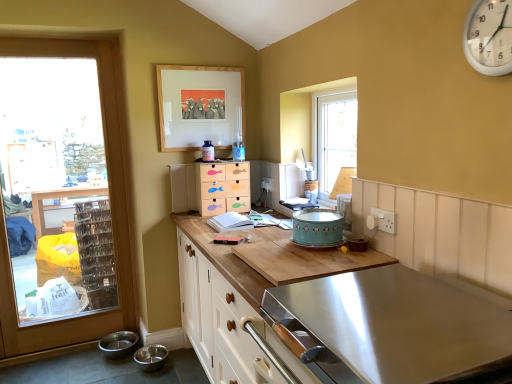
Question: From a real-world perspective, is white plastic clock at upper right located higher than wooden drawers at center, which ranks as the first appliance in back-to-front order?

Choices:
 (A) yes
 (B) no

Answer: (A)

Question: Is white plastic clock at upper right positioned with its back to wooden drawers at center, the 1th appliance when ordered from left to right?

Choices:
 (A) yes
 (B) no

Answer: (B)

Question: Is white plastic clock at upper right placed right next to wooden drawers at center, the first appliance when ordered from top to bottom?

Choices:
 (A) no
 (B) yes

Answer: (A)

Question: Is white plastic clock at upper right thinner than wooden drawers at center, acting as the second appliance starting from the front?

Choices:
 (A) yes
 (B) no

Answer: (A)

Question: From the image's perspective, would you say white plastic clock at upper right is positioned over wooden drawers at center, the 2th appliance from the right?

Choices:
 (A) no
 (B) yes

Answer: (B)

Question: Based on their positions, is wooden drawers at center, acting as the second appliance starting from the front, located to the left or right of wooden cutting board at center, acting as the 2th countertop starting from the bottom?

Choices:
 (A) left
 (B) right

Answer: (A)

Question: Is point (172, 188) positioned closer to the camera than point (224, 248)?

Choices:
 (A) farther
 (B) closer

Answer: (A)

Question: From a real-world perspective, is wooden drawers at center, acting as the second appliance starting from the front, above or below wooden cutting board at center, which appears as the first countertop when viewed from the top?

Choices:
 (A) above
 (B) below

Answer: (A)

Question: Is wooden drawers at center, the 1th appliance when ordered from left to right, situated inside wooden cutting board at center, acting as the 2th countertop starting from the bottom, or outside?

Choices:
 (A) outside
 (B) inside

Answer: (A)

Question: Looking at the image, does wooden fish-themed drawer set at center seem bigger or smaller compared to wooden picture frame at upper center?

Choices:
 (A) big
 (B) small

Answer: (A)

Question: From the image's perspective, is wooden fish-themed drawer set at center positioned above or below wooden picture frame at upper center?

Choices:
 (A) below
 (B) above

Answer: (A)

Question: Does point (204, 203) appear closer or farther from the camera than point (175, 99)?

Choices:
 (A) closer
 (B) farther

Answer: (A)

Question: In terms of width, does wooden fish-themed drawer set at center look wider or thinner when compared to wooden picture frame at upper center?

Choices:
 (A) wide
 (B) thin

Answer: (A)

Question: Considering their positions, is white plastic clock at upper right located in front of or behind wooden fish-themed drawer set at center?

Choices:
 (A) behind
 (B) front

Answer: (B)

Question: Is white plastic clock at upper right taller or shorter than wooden fish-themed drawer set at center?

Choices:
 (A) short
 (B) tall

Answer: (A)